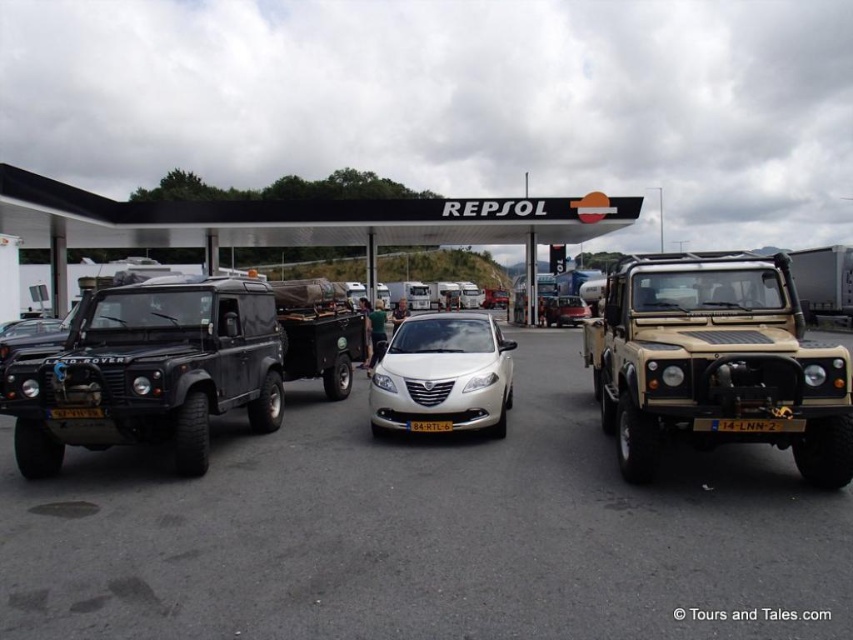
Is the position of matte black suv at left more distant than that of black metal/glass canopy at center?

No, matte black suv at left is closer to the viewer.

Who is higher up, matte black suv at left or black metal/glass canopy at center?

black metal/glass canopy at center is higher up.

Does point (91, 380) come behind point (209, 268)?

No, it is in front of (209, 268).

Locate an element on the screen. matte black suv at left is located at coordinates (152, 371).

Is matte black suv at left shorter than white glossy sedan at center?

No, matte black suv at left is not shorter than white glossy sedan at center.

Can you confirm if matte black suv at left is wider than white glossy sedan at center?

Yes, matte black suv at left is wider than white glossy sedan at center.

The image size is (853, 640). In order to click on matte black suv at left in this screenshot , I will do `click(152, 371)`.

I want to click on matte black suv at left, so click(152, 371).

Can you confirm if matte black suv at left is positioned above black plastic license plate at center?

Correct, matte black suv at left is located above black plastic license plate at center.

Who is more forward, (x=221, y=397) or (x=53, y=419)?

Positioned in front is point (x=53, y=419).

Where is `matte black suv at left`? The image size is (853, 640). matte black suv at left is located at coordinates (152, 371).